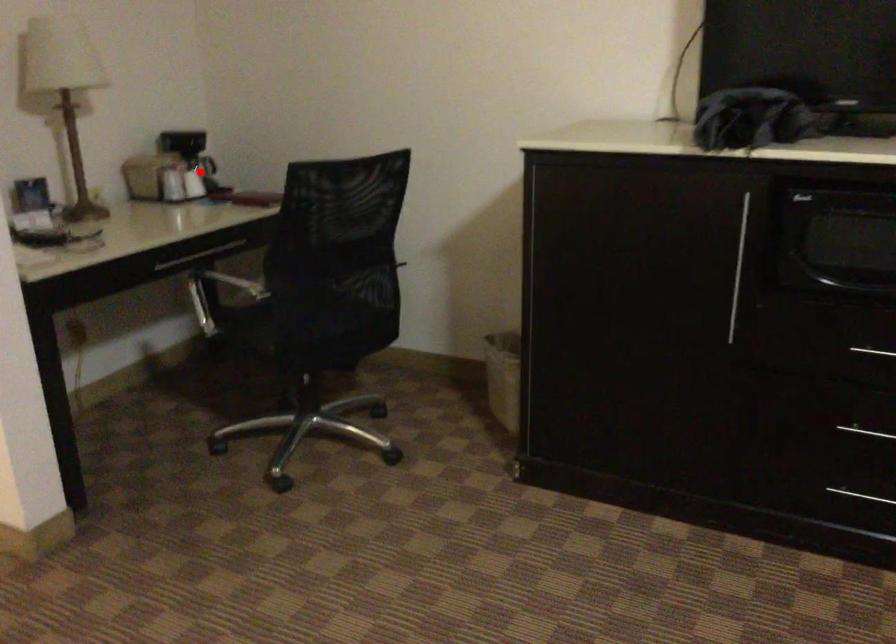
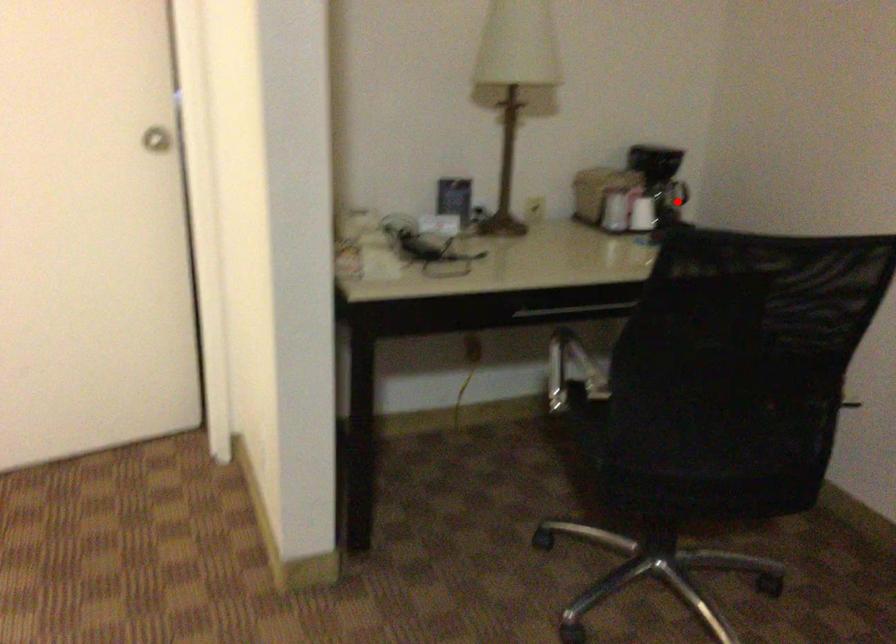
I am providing you with two images of the same scene from different viewpoints. A red point is marked on the first image and another point is marked on the second image. Is the red point in image1 aligned with the point shown in image2?

Yes